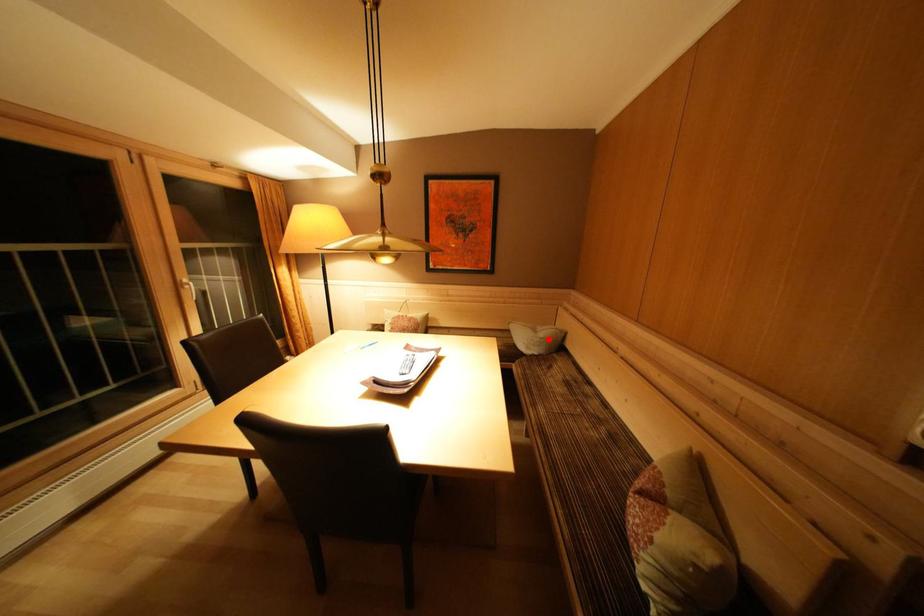
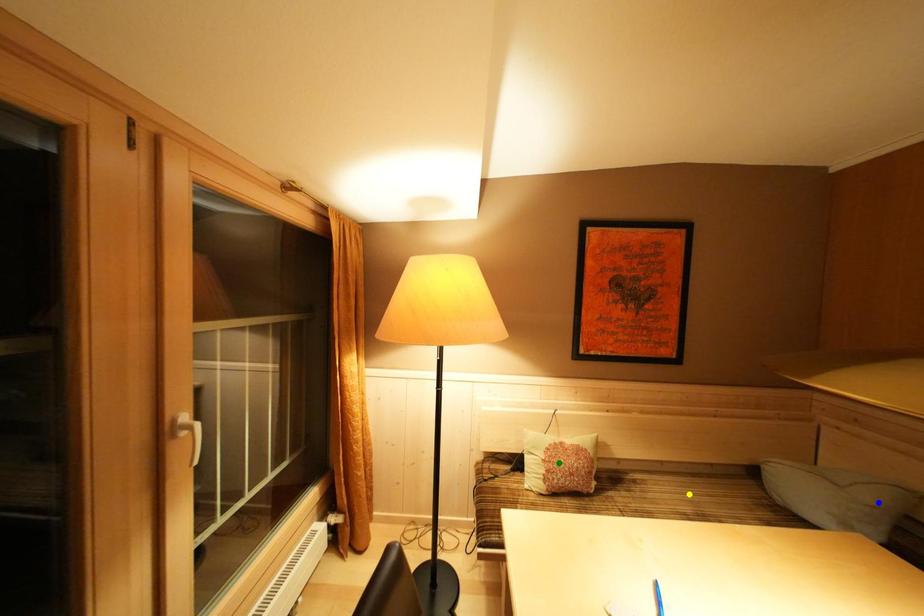
Question: I am providing you with two images of the same scene from different viewpoints. A red point is marked on the first image. You are given multiple points on the second image. Which point in image 2 is actually the same real-world point as the red point in image 1?

Choices:
 (A) yellow point
 (B) blue point
 (C) green point

Answer: (B)